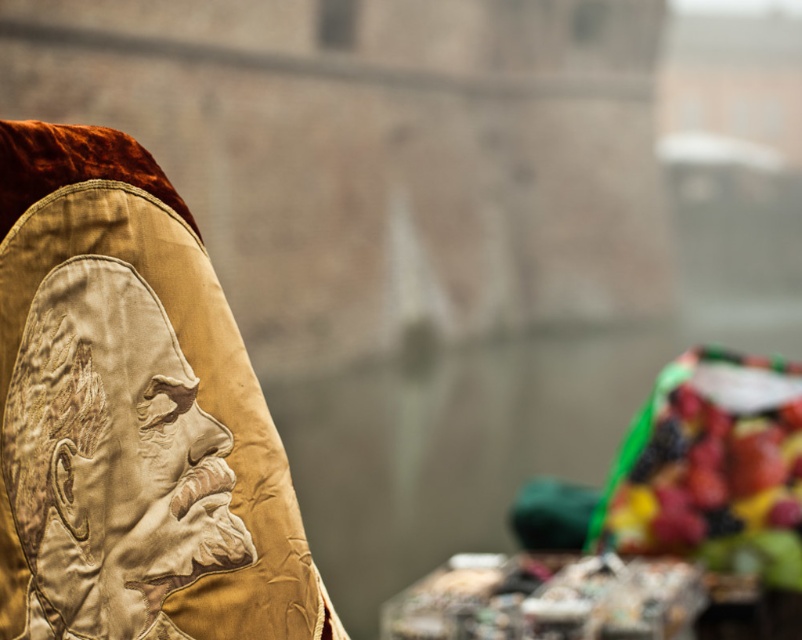
Does satin gold portrait at left have a greater height compared to shiny plastic fruits at right?

No.

Is point (118, 456) farther from viewer compared to point (695, 468)?

No, it is not.

Find the location of a particular element. The height and width of the screenshot is (640, 802). satin gold portrait at left is located at coordinates (111, 460).